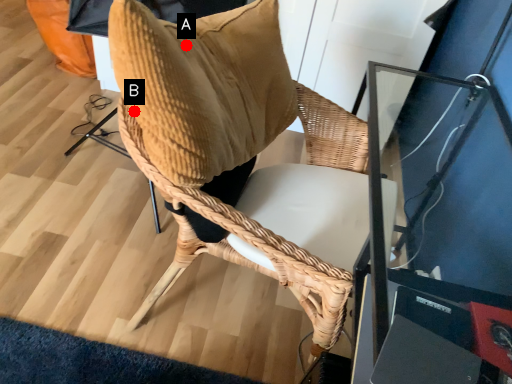
Question: Two points are circled on the image, labeled by A and B beside each circle. Which point is farther from the camera taking this photo?

Choices:
 (A) A is further
 (B) B is further

Answer: (A)